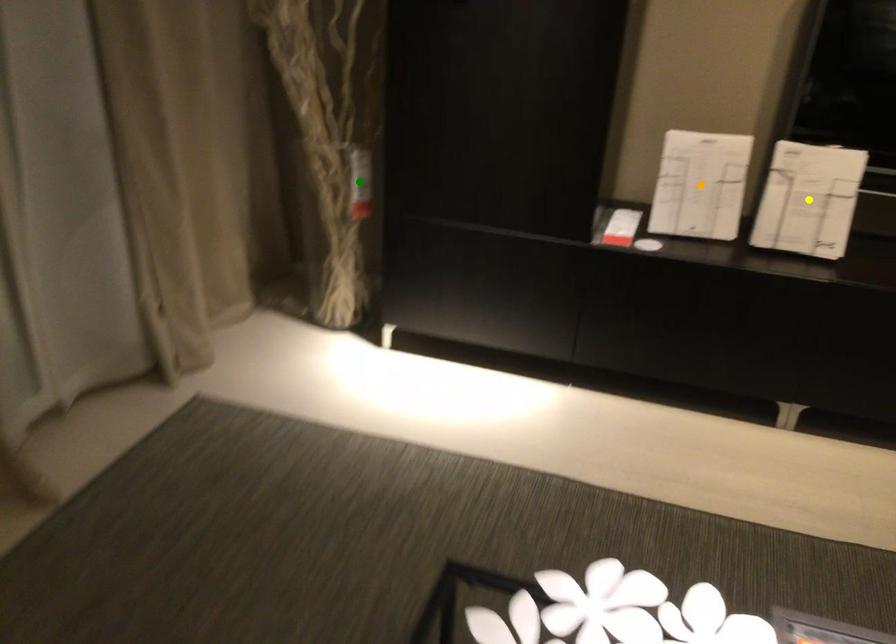
Order these from nearest to farthest:
orange point, green point, yellow point

1. yellow point
2. orange point
3. green point